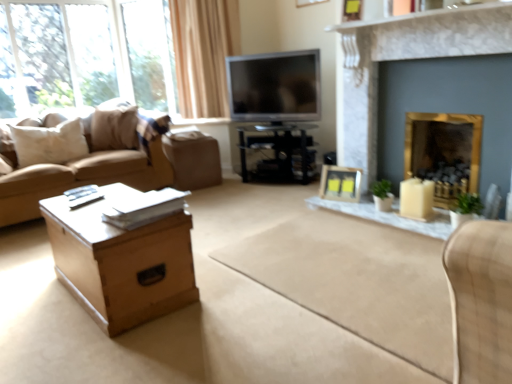
Question: Is white marble fireplace at upper center taller or shorter than white matte candle holder at right?

Choices:
 (A) short
 (B) tall

Answer: (A)

Question: Is point (409, 16) closer or farther from the camera than point (423, 198)?

Choices:
 (A) closer
 (B) farther

Answer: (A)

Question: Based on their relative distances, which object is nearer to the white marble glass table at center?

Choices:
 (A) light brown wooden table at lower left, the second table viewed from the back
 (B) transparent glass window at upper left
 (C) gold marble fireplace at upper right, the 2th fireplace when ordered from back to front
 (D) white fabric armchair at right
 (E) gold metallic fireplace at right, which is the 1th fireplace in back-to-front order

Answer: (E)

Question: Estimate the real-world distances between objects in this image. Which object is farther from the black glossy tv stand at center, the 1th table from the top?

Choices:
 (A) white soft pillow at left
 (B) white marble fireplace at upper center
 (C) white fabric armchair at right
 (D) gold marble fireplace at upper right, which is counted as the 1th fireplace, starting from the front
 (E) matte yellow picture frame at center, arranged as the 1th picture frame when ordered from the bottom

Answer: (C)